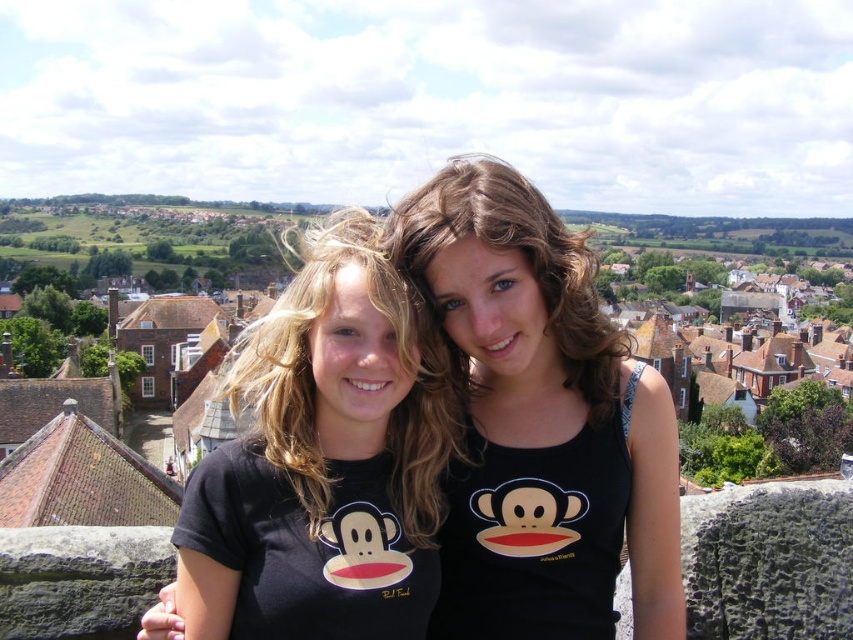
Looking at this image, between black matte tank top at center and matte black shirt at center, which one has less height?

black matte tank top at center is shorter.

Identify the location of black matte tank top at center. (538, 422).

Identify the location of black matte tank top at center. 538,422.

Is black matte t-shirt at center closer to the viewer compared to matte black shirt at center?

Yes, it is.

Based on the photo, does black matte t-shirt at center appear over matte black shirt at center?

No.

You are a GUI agent. You are given a task and a screenshot of the screen. Output one action in this format:
    pyautogui.click(x=<x>, y=<y>)
    Task: Click on the black matte t-shirt at center
    Image resolution: width=853 pixels, height=640 pixels.
    Given the screenshot: What is the action you would take?
    pyautogui.click(x=322, y=461)

Who is more forward, (575, 269) or (279, 502)?

Positioned in front is point (279, 502).

Who is higher up, black matte tank top at center or black matte t-shirt at center?

black matte tank top at center

Image resolution: width=853 pixels, height=640 pixels. What are the coordinates of `black matte tank top at center` in the screenshot? It's located at (538, 422).

Identify the location of black matte tank top at center. The width and height of the screenshot is (853, 640). (x=538, y=422).